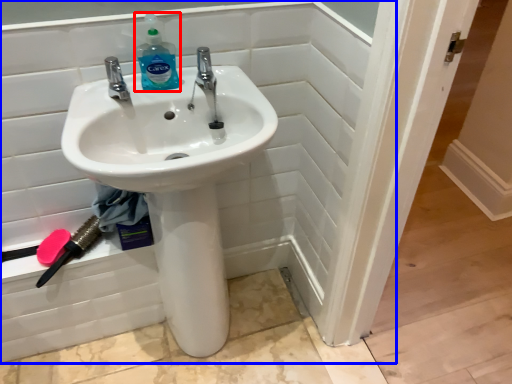
Question: Which of the following is the closest to the observer, cleaning product (highlighted by a red box) or bath (highlighted by a blue box)?

Choices:
 (A) cleaning product
 (B) bath

Answer: (B)